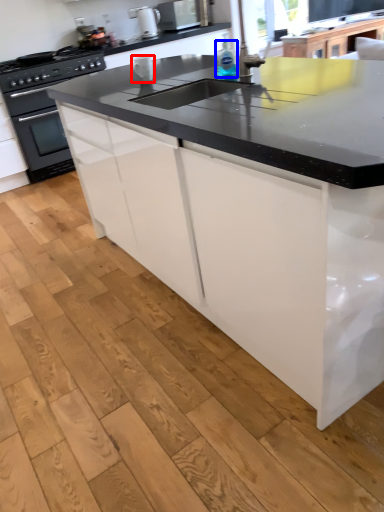
Question: Which object is closer to the camera taking this photo, appliance (highlighted by a red box) or bottle (highlighted by a blue box)?

Choices:
 (A) appliance
 (B) bottle

Answer: (B)